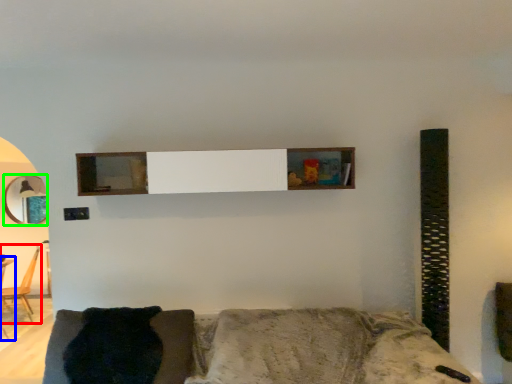
Question: Which object is the closest to the chair (highlighted by a red box)? Choose among these: table (highlighted by a blue box) or mirror (highlighted by a green box).

Choices:
 (A) table
 (B) mirror

Answer: (A)